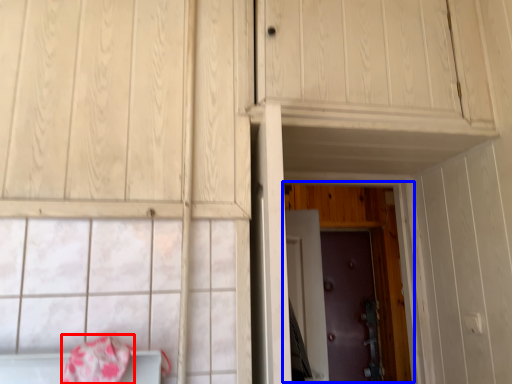
Question: Which point is further to the camera, blanket (highlighted by a red box) or door (highlighted by a blue box)?

Choices:
 (A) blanket
 (B) door

Answer: (B)